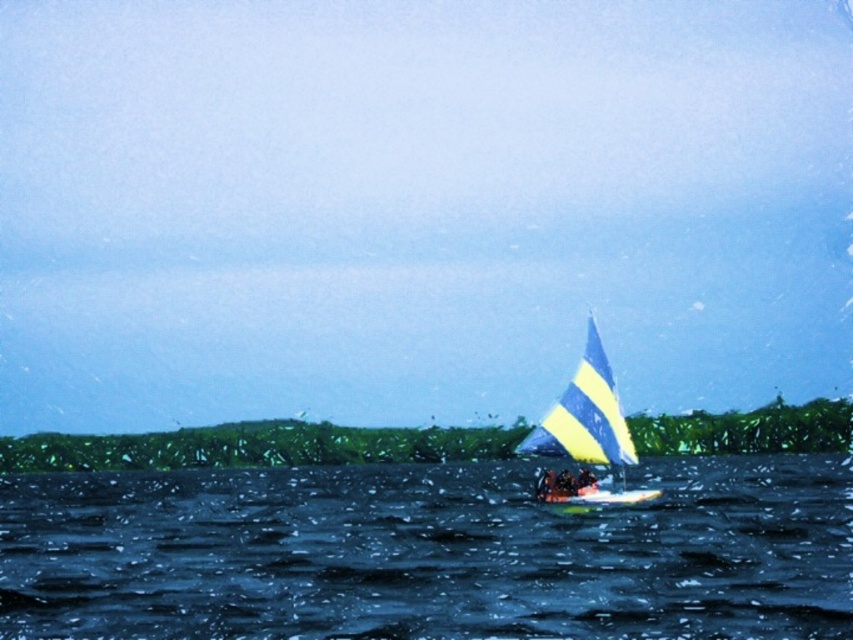
Identify the location of dark blue water at center. The width and height of the screenshot is (853, 640). (428, 554).

Can you confirm if dark blue water at center is positioned below yellow striped sailboat at center?

Yes, dark blue water at center is below yellow striped sailboat at center.

Between point (9, 636) and point (625, 442), which one is positioned in front?

Point (9, 636)

I want to click on dark blue water at center, so click(428, 554).

Between dark blue water at center and smooth skin person at center, which one appears on the left side from the viewer's perspective?

Positioned to the left is smooth skin person at center.

Between dark blue water at center and smooth skin person at center, which one has less height?

With less height is smooth skin person at center.

Between point (97, 616) and point (556, 483), which one is positioned behind?

Positioned behind is point (556, 483).

This screenshot has width=853, height=640. In order to click on dark blue water at center in this screenshot , I will do `click(428, 554)`.

Is point (570, 483) closer to camera compared to point (587, 493)?

No, (570, 483) is further to viewer.

What do you see at coordinates (566, 483) in the screenshot? This screenshot has width=853, height=640. I see `smooth skin person at center` at bounding box center [566, 483].

At what (x,y) coordinates should I click in order to perform the action: click on smooth skin person at center. Please return your answer as a coordinate pair (x, y). The height and width of the screenshot is (640, 853). Looking at the image, I should click on (566, 483).